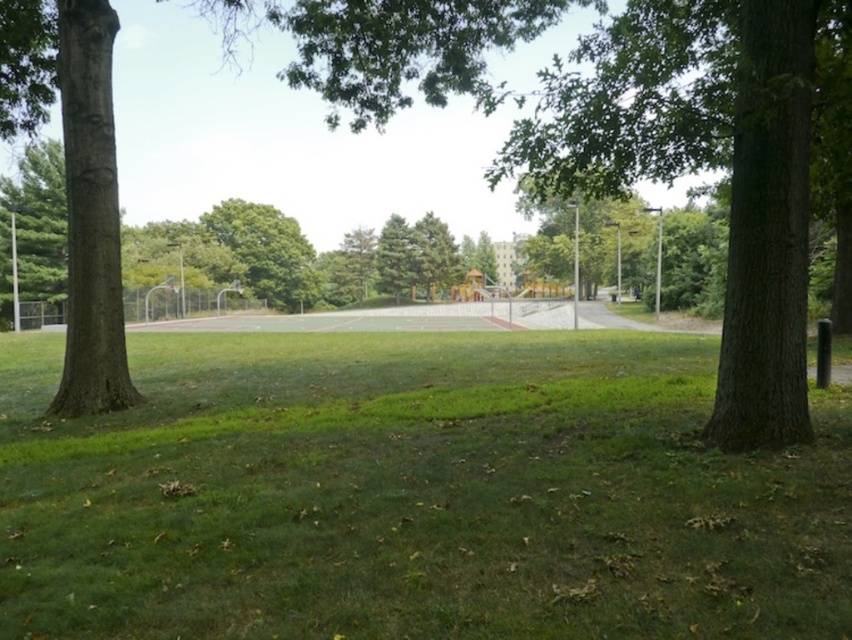
Question: Can you confirm if green grassy area at center is smaller than brown rough tree at center?

Choices:
 (A) no
 (B) yes

Answer: (B)

Question: Does green grassy area at center have a greater width compared to brown rough tree at center?

Choices:
 (A) yes
 (B) no

Answer: (B)

Question: Among these points, which one is farthest from the camera?

Choices:
 (A) (493, 621)
 (B) (330, 26)

Answer: (B)

Question: Which of the following is the closest to the observer?

Choices:
 (A) brown rough tree at center
 (B) green grassy area at center

Answer: (B)

Question: Can you confirm if green grassy area at center is thinner than brown rough tree at center?

Choices:
 (A) yes
 (B) no

Answer: (A)

Question: Among these objects, which one is farthest from the camera?

Choices:
 (A) green grassy area at center
 (B) brown rough tree at center

Answer: (B)